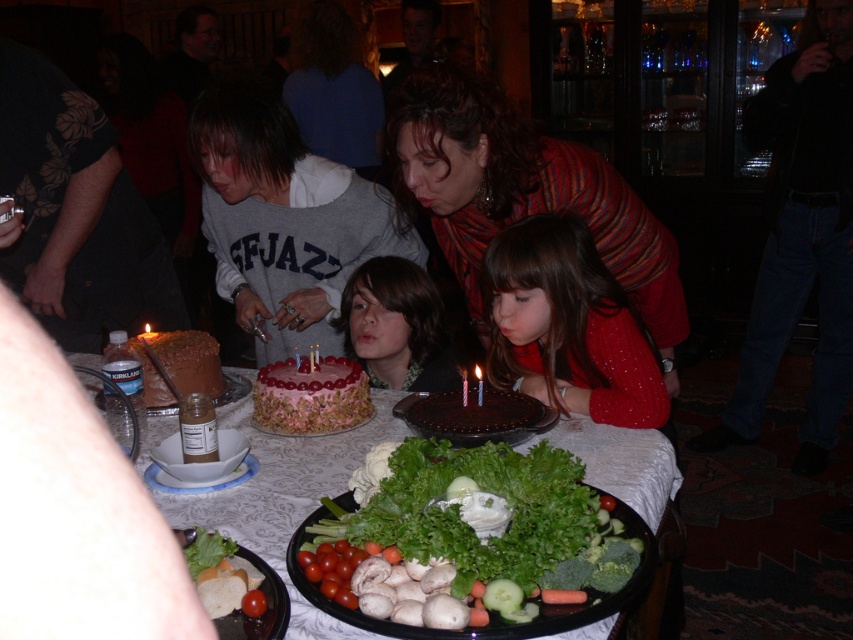
Question: Among these objects, which one is farthest from the camera?

Choices:
 (A) green leafy lettuce at center
 (B) sparkly red sweater at center
 (C) green leafy vegetables at center
 (D) chocolate cake at center

Answer: (B)

Question: Does striped sweater at center appear on the right side of pink frosted cake at center?

Choices:
 (A) no
 (B) yes

Answer: (B)

Question: Does striped sweater at center appear over chocolate cake at center?

Choices:
 (A) no
 (B) yes

Answer: (B)

Question: Does sparkly red sweater at center come behind translucent plastic candle at center?

Choices:
 (A) no
 (B) yes

Answer: (B)

Question: Which of these objects is positioned closest to the pink frosted cake at center?

Choices:
 (A) translucent plastic candle at center
 (B) smooth pink cake at center
 (C) chocolate cake at center

Answer: (C)

Question: Which object is positioned closest to the green leafy lettuce at center?

Choices:
 (A) sparkly red sweater at center
 (B) green leafy vegetables at center
 (C) chocolate cake at center

Answer: (B)